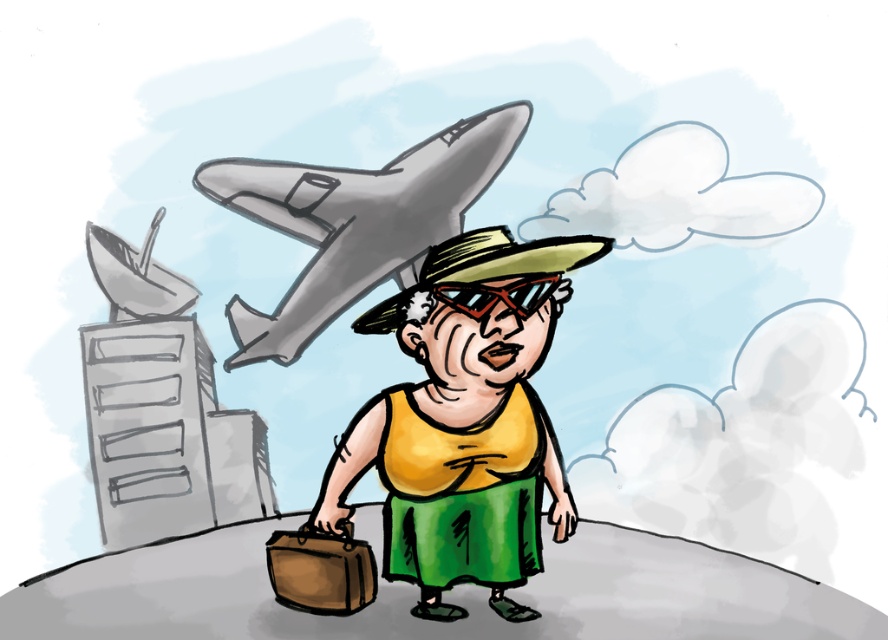
Question: Which of the following is the farthest from the observer?

Choices:
 (A) brown leather suitcase at lower center
 (B) gray metallic airplane at upper center
 (C) yellow fabric shirt at center
 (D) matte black goggles at center

Answer: (B)

Question: Which point appears closest to the camera in this image?

Choices:
 (A) tap(497, 294)
 (B) tap(316, 602)

Answer: (A)

Question: Can you confirm if yellow fabric shirt at center is wider than matte black goggles at center?

Choices:
 (A) yes
 (B) no

Answer: (A)

Question: Does yellow fabric shirt at center have a larger size compared to matte black goggles at center?

Choices:
 (A) no
 (B) yes

Answer: (B)

Question: Does yellow fabric shirt at center appear over matte black goggles at center?

Choices:
 (A) yes
 (B) no

Answer: (B)

Question: Which object is positioned closest to the yellow fabric shirt at center?

Choices:
 (A) brown leather suitcase at lower center
 (B) gray metallic airplane at upper center
 (C) matte black goggles at center

Answer: (C)